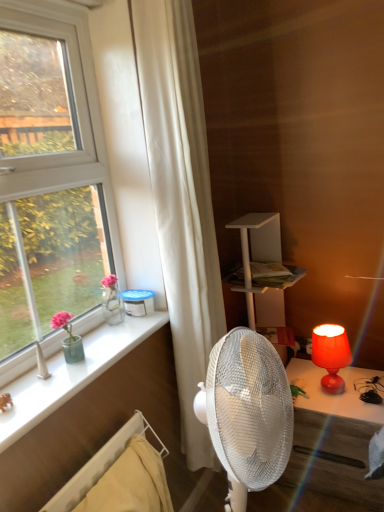
Where is `blank space situated above matte red lamp at right (from a real-world perspective)`? This screenshot has width=384, height=512. blank space situated above matte red lamp at right (from a real-world perspective) is located at coordinates pos(318,390).